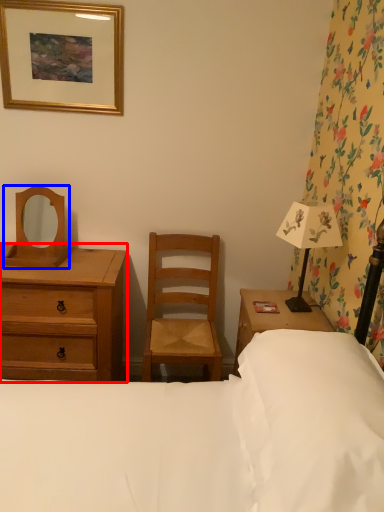
Question: Which of the following is the farthest to the observer, chest of drawers (highlighted by a red box) or mirror (highlighted by a blue box)?

Choices:
 (A) chest of drawers
 (B) mirror

Answer: (B)